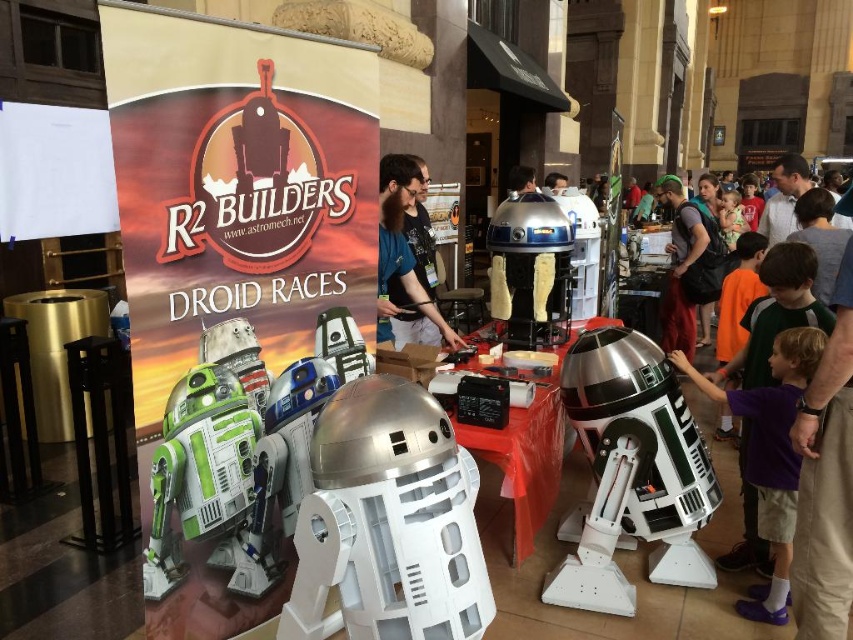
You are organizing a display for the R2 Builders event and need to place a new sign that requires at least 2 meters of space between the two central droids. Given the sizes of the metallic blue droid at center and the metallic silver robot at center, will there be enough space between them?

The metallic blue droid at center is bigger than the metallic silver robot at center, but the exact distance between them isn

You are a guest at the R2 Builders event and want to take a photo of the blue fabric shirt at center. Your camera has a minimum focus distance of 3 meters. Can you take a clear photo without moving closer?

The blue fabric shirt at center is 3.37 meters away from the viewer. Since the camera can focus as close as 3 meters, the distance is within the camera range. Therefore, you can take a clear photo without moving closer.